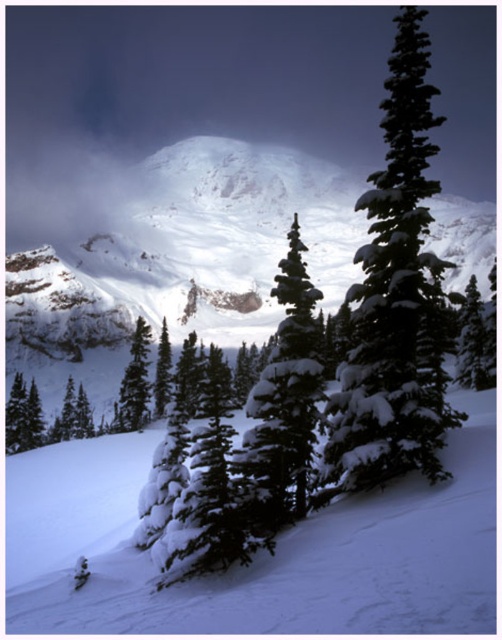
Question: From the image, what is the correct spatial relationship of snowy pine trees at lower center in relation to green matte evergreen tree at center-left?

Choices:
 (A) below
 (B) above

Answer: (A)

Question: Is snow-covered pine tree at center-left smaller than green matte evergreen tree at center-left?

Choices:
 (A) no
 (B) yes

Answer: (A)

Question: Which point is closer to the camera?

Choices:
 (A) snow-covered pine tree at right
 (B) snowy pine trees at lower center
 (C) snow-covered evergreen at center-right
 (D) green matte evergreen tree at center

Answer: (B)

Question: Is the position of snowy pine trees at lower center more distant than that of snowy granite mountain at upper center?

Choices:
 (A) no
 (B) yes

Answer: (A)

Question: Which object is farther from the camera taking this photo?

Choices:
 (A) snow-covered pine tree at center-left
 (B) snowy pine trees at lower center
 (C) snow-covered evergreen at center-right

Answer: (A)

Question: Which point appears farthest from the camera in this image?

Choices:
 (A) (406, 145)
 (B) (391, 502)

Answer: (A)